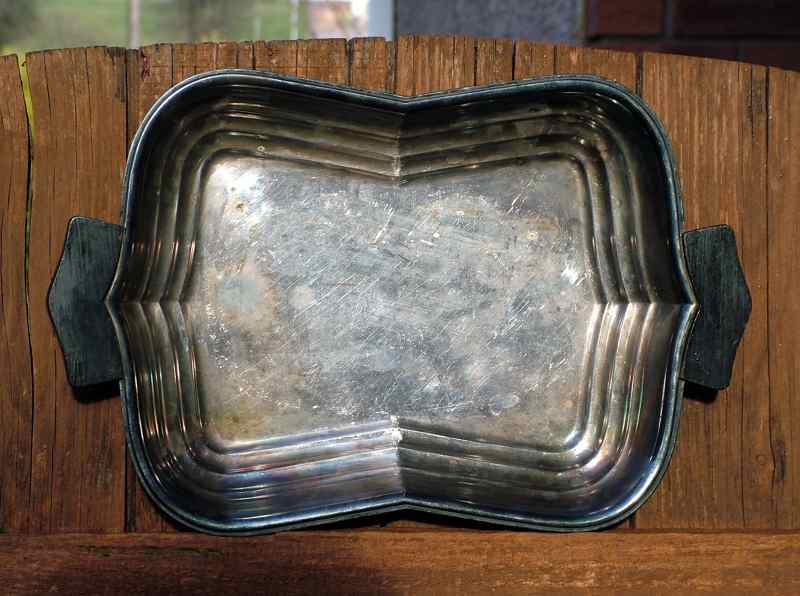
In order to click on board in this screenshot , I will do `click(82, 486)`.